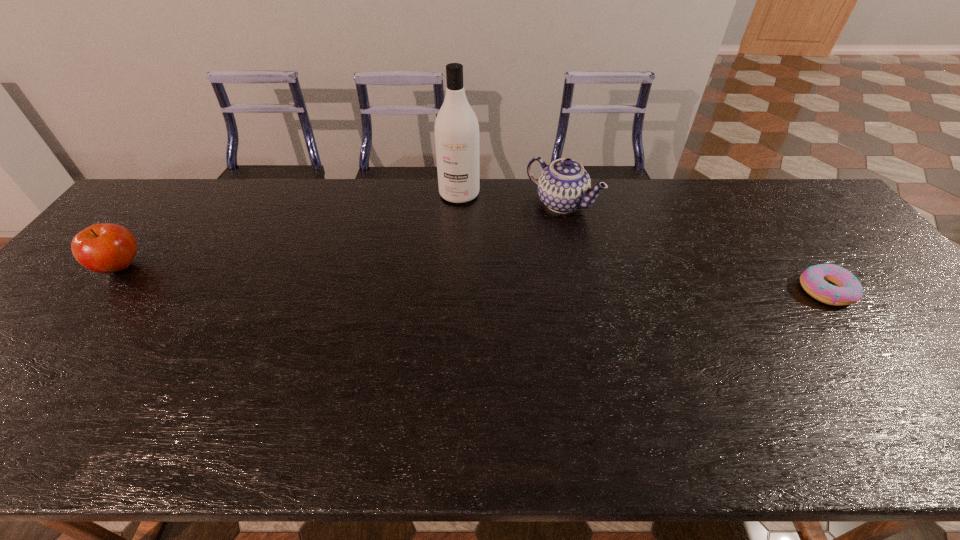
Locate an element on the screen. The image size is (960, 540). blank space located 0.330m at the spout of the second object from right to left is located at coordinates (472, 274).

Image resolution: width=960 pixels, height=540 pixels. I want to click on vacant space located 0.380m at the spout of the second object from right to left, so click(460, 285).

Locate an element on the screen. The height and width of the screenshot is (540, 960). vacant space located at the spout of the second object from right to left is located at coordinates (508, 245).

In order to click on vacant area situated on the front-facing side of the third object from right to left in this screenshot , I will do `click(425, 284)`.

The height and width of the screenshot is (540, 960). I want to click on vacant space located 0.230m on the front-facing side of the third object from right to left, so click(x=437, y=254).

Identify the location of free space located 0.170m on the front-facing side of the third object from right to left. This screenshot has height=540, width=960. (442, 240).

I want to click on chinaware that is at the far edge, so click(563, 186).

In order to click on shampoo located at the far edge in this screenshot , I will do `click(456, 128)`.

Locate an element on the screen. object that is positioned at the left edge is located at coordinates (106, 248).

This screenshot has height=540, width=960. What are the coordinates of `object positioned at the right edge` in the screenshot? It's located at (815, 280).